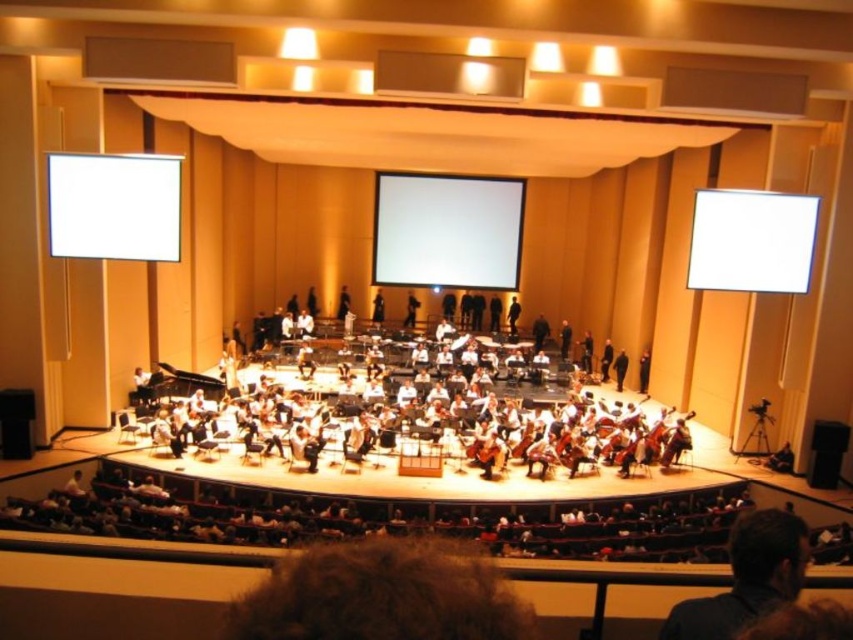
Question: Which object is closer to the camera taking this photo?

Choices:
 (A) dark brown hair at lower right
 (B) white glossy orchestra at center
 (C) black fabric coat at center
 (D) black polished piano at center

Answer: (A)

Question: Is white matte screen at upper left positioned at the back of white glossy screen at upper right?

Choices:
 (A) no
 (B) yes

Answer: (A)

Question: Does white matte screen at center come behind black fabric coat at center?

Choices:
 (A) yes
 (B) no

Answer: (A)

Question: Which point is closer to the camera taking this photo?

Choices:
 (A) (619, 376)
 (B) (637, 385)
 (C) (424, 429)

Answer: (C)

Question: Which of the following is the closest to the observer?

Choices:
 (A) (427, 240)
 (B) (718, 260)

Answer: (B)

Question: Does black fabric coat at center appear on the right side of dark brown suit at center?

Choices:
 (A) yes
 (B) no

Answer: (A)